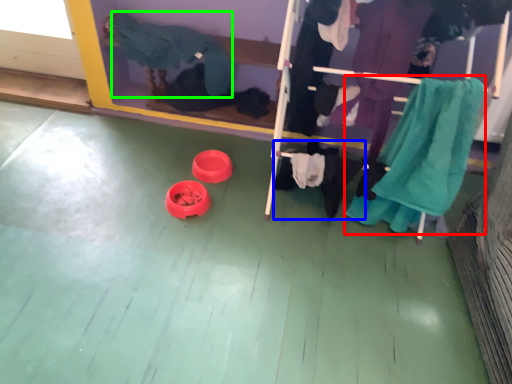
Question: Which object is positioned farthest from clothing (highlighted by a red box)? Select from clothing (highlighted by a blue box) and clothing (highlighted by a green box).

Choices:
 (A) clothing
 (B) clothing

Answer: (B)